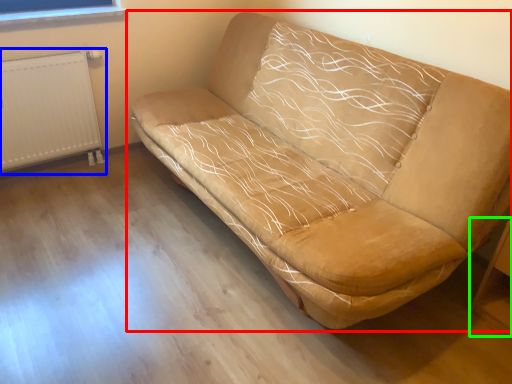
Question: Considering the real-world distances, which object is closest to studio couch (highlighted by a red box)? radiator (highlighted by a blue box) or table (highlighted by a green box).

Choices:
 (A) radiator
 (B) table

Answer: (B)